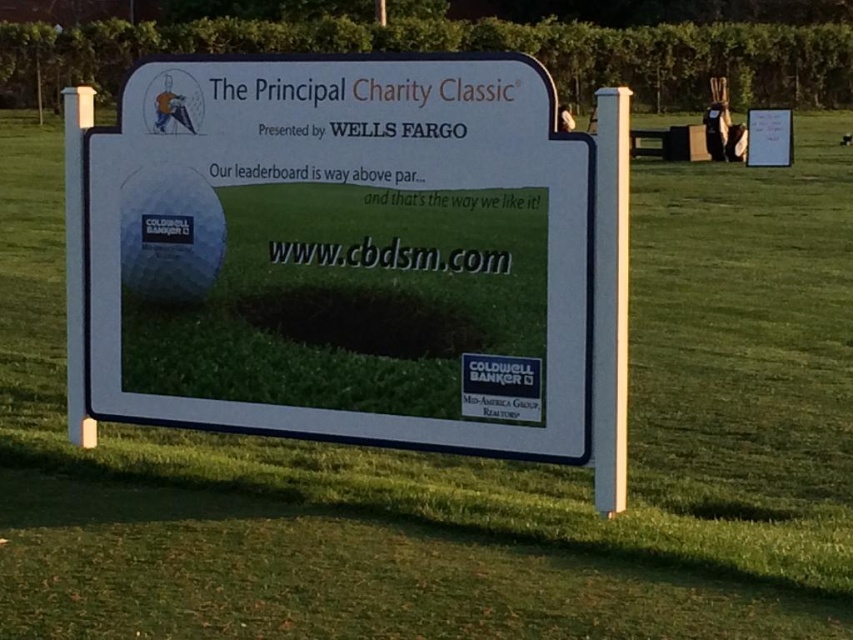
You are standing in the field and see the white plastic sign at center and the yellow fabric golfer at upper left. Which object is positioned more to the left side of the scene?

The yellow fabric golfer at upper left is positioned more to the left side of the scene because the white plastic sign at center is to the right of it.

You are standing facing the large signboard on the grassy field. You notice the white plastic sign at center and the yellow fabric golfer at upper left. Which object is positioned higher up on the signboard?

The yellow fabric golfer at upper left is positioned higher up on the signboard than the white plastic sign at center because the white plastic sign at center is located below it.

You are a photographer setting up equipment on the grassy field. You have a camera with a 30cm wide lens. The white plastic sign at center and the yellow fabric golfer at upper left are both in your shot. Can the camera lens capture both objects in the frame at the same time?

The white plastic sign at center is wider than the yellow fabric golfer at upper left, so the camera lens with a 30cm wide lens can capture both objects in the frame at the same time if their combined width is within 30cm. However, the exact distance and positioning would determine this, but based on the description, the sign is larger, so it might require adjusting the camera angle to include both.